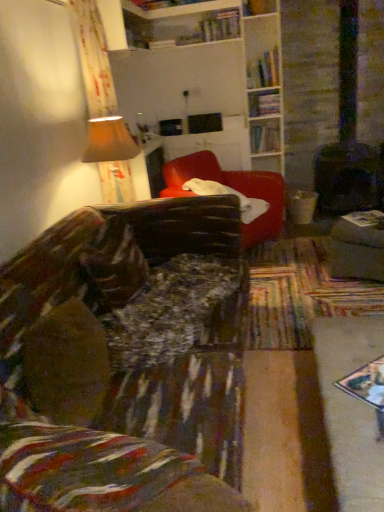
Question: From a real-world perspective, is matte beige lampshade at upper left on top of hardcover book at upper center, arranged as the fourth book when viewed from the right?

Choices:
 (A) no
 (B) yes

Answer: (A)

Question: Considering the relative sizes of matte beige lampshade at upper left and hardcover book at upper center, which ranks as the fourth book in bottom-to-top order, in the image provided, is matte beige lampshade at upper left wider than hardcover book at upper center, which ranks as the fourth book in bottom-to-top order,?

Choices:
 (A) no
 (B) yes

Answer: (B)

Question: Is matte beige lampshade at upper left touching hardcover book at upper center, the 2th book in the back-to-front sequence?

Choices:
 (A) no
 (B) yes

Answer: (A)

Question: Does matte beige lampshade at upper left appear on the right side of hardcover book at upper center, the 2th book in the back-to-front sequence?

Choices:
 (A) yes
 (B) no

Answer: (B)

Question: Is hardcover book at upper center, the 3th book when ordered from front to back, inside matte beige lampshade at upper left?

Choices:
 (A) yes
 (B) no

Answer: (B)

Question: From the image's perspective, is hardcover books at upper right, the 3th book in the bottom-to-top sequence, located above or below velvet-like red couch at center, the second studio couch positioned from the bottom?

Choices:
 (A) below
 (B) above

Answer: (B)

Question: Is hardcover books at upper right, the second book when ordered from left to right, spatially inside velvet-like red couch at center, the 1th studio couch when ordered from top to bottom, or outside of it?

Choices:
 (A) outside
 (B) inside

Answer: (A)

Question: Is hardcover books at upper right, which is the third book in right-to-left order, in front of or behind velvet-like red couch at center, placed as the 2th studio couch when sorted from front to back, in the image?

Choices:
 (A) behind
 (B) front

Answer: (A)

Question: Considering the positions of hardcover books at upper right, which is counted as the 3th book, starting from the back, and velvet-like red couch at center, the 1th studio couch when ordered from top to bottom, in the image, is hardcover books at upper right, which is counted as the 3th book, starting from the back, bigger or smaller than velvet-like red couch at center, the 1th studio couch when ordered from top to bottom,?

Choices:
 (A) big
 (B) small

Answer: (B)

Question: Considering the positions of point (248, 72) and point (24, 453), is point (248, 72) closer or farther from the camera than point (24, 453)?

Choices:
 (A) closer
 (B) farther

Answer: (B)

Question: Considering the positions of hardcover books at upper right, the second book when ordered from left to right, and velvet-like brown couch at lower left, the 2th studio couch positioned from the top, in the image, is hardcover books at upper right, the second book when ordered from left to right, wider or thinner than velvet-like brown couch at lower left, the 2th studio couch positioned from the top,?

Choices:
 (A) thin
 (B) wide

Answer: (B)

Question: From the image's perspective, is hardcover books at upper right, which is the third book in right-to-left order, above or below velvet-like brown couch at lower left, the first studio couch positioned from the bottom?

Choices:
 (A) below
 (B) above

Answer: (B)

Question: Is hardcover books at upper right, the second book when ordered from left to right, to the left or to the right of velvet-like brown couch at lower left, the 2th studio couch positioned from the top, in the image?

Choices:
 (A) left
 (B) right

Answer: (B)

Question: From a real-world perspective, is hardcover book at upper center, positioned as the 2th book in right-to-left order, above or below wooden bookshelf at upper center, positioned as the second shelf in bottom-to-top order?

Choices:
 (A) below
 (B) above

Answer: (A)

Question: Is hardcover book at upper center, which is the 3th book in top-to-bottom order, wider or thinner than wooden bookshelf at upper center, acting as the 2th shelf starting from the back?

Choices:
 (A) thin
 (B) wide

Answer: (B)